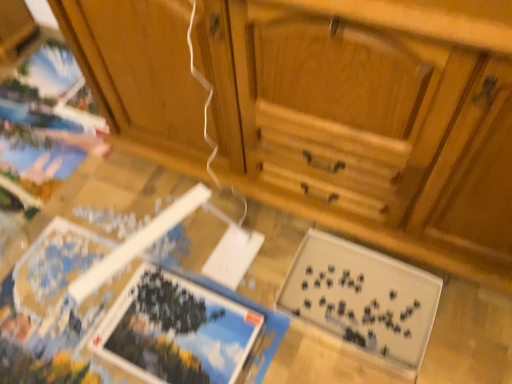
Identify the location of vacant point above blue glossy puzzle piece at lower left, the second magazine from the right (from a real-world perspective). Image resolution: width=512 pixels, height=384 pixels. (179, 327).